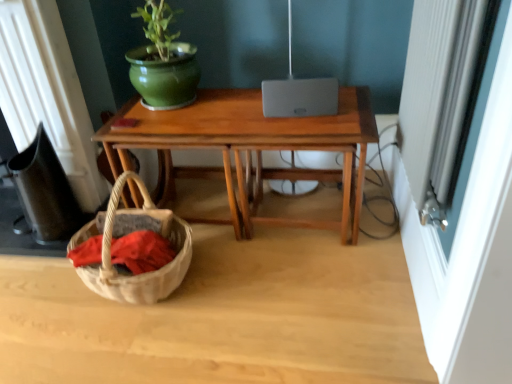
What is the approximate width of wooden desk at center?

It is 19.92 inches.

Identify the location of satin silver lamp at center. This screenshot has width=512, height=384. (298, 91).

At what (x,y) coordinates should I click in order to perform the action: click on white textured screen door at right. Please return your answer as a coordinate pair (x, y). This screenshot has height=384, width=512. Looking at the image, I should click on (460, 190).

The height and width of the screenshot is (384, 512). What do you see at coordinates (460, 190) in the screenshot? I see `white textured screen door at right` at bounding box center [460, 190].

The height and width of the screenshot is (384, 512). In order to click on wooden desk at center in this screenshot , I will do `click(249, 149)`.

Can you confirm if white textured screen door at right is thinner than wooden desk at center?

Indeed, white textured screen door at right has a lesser width compared to wooden desk at center.

Considering the sizes of objects white textured screen door at right and wooden desk at center in the image provided, who is taller, white textured screen door at right or wooden desk at center?

white textured screen door at right.

Is white textured screen door at right positioned in front of wooden desk at center?

Yes, the depth of white textured screen door at right is less than that of wooden desk at center.

Considering the positions of objects white textured screen door at right and wooden desk at center in the image provided, who is more to the right, white textured screen door at right or wooden desk at center?

From the viewer's perspective, white textured screen door at right appears more on the right side.

Is white textured screen door at right facing towards satin silver lamp at center?

No, white textured screen door at right is not facing towards satin silver lamp at center.

Choose the correct answer: Is white textured screen door at right inside satin silver lamp at center or outside it?

white textured screen door at right is spatially situated outside satin silver lamp at center.

Between point (428, 28) and point (293, 98), which one is positioned in front?

The point (428, 28) is more forward.

From the image's perspective, which one is positioned lower, satin silver lamp at center or white textured screen door at right?

white textured screen door at right appears lower in the image.

Is satin silver lamp at center next to white textured screen door at right and touching it?

No, satin silver lamp at center is not touching white textured screen door at right.

Between satin silver lamp at center and white textured screen door at right, which one appears on the left side from the viewer's perspective?

satin silver lamp at center is more to the left.

From the image's perspective, who appears lower, satin silver lamp at center or wooden desk at center?

wooden desk at center, from the image's perspective.

Where is `lamp that is above the wooden desk at center (from a real-world perspective)`? This screenshot has height=384, width=512. lamp that is above the wooden desk at center (from a real-world perspective) is located at coordinates (298, 91).

Does satin silver lamp at center have a larger size compared to wooden desk at center?

Incorrect, satin silver lamp at center is not larger than wooden desk at center.

Is satin silver lamp at center aimed at wooden desk at center?

Yes, satin silver lamp at center is aimed at wooden desk at center.

Is wooden desk at center wider than white textured screen door at right?

Yes, wooden desk at center is wider than white textured screen door at right.

Is the depth of wooden desk at center greater than that of white textured screen door at right?

Yes.

From a real-world perspective, which is physically above, wooden desk at center or white textured screen door at right?

white textured screen door at right, from a real-world perspective.

Can you confirm if wooden desk at center is bigger than white textured screen door at right?

Indeed, wooden desk at center has a larger size compared to white textured screen door at right.

Who is bigger, wooden desk at center or satin silver lamp at center?

With larger size is wooden desk at center.

Can you confirm if wooden desk at center is taller than satin silver lamp at center?

No.

The height and width of the screenshot is (384, 512). What are the coordinates of `desk that appears below the satin silver lamp at center (from the image's perspective)` in the screenshot? It's located at (249, 149).

From the picture: Is wooden desk at center oriented away from satin silver lamp at center?

Yes, wooden desk at center is facing away from satin silver lamp at center.

What are the coordinates of `desk lying below the white textured screen door at right (from the image's perspective)` in the screenshot? It's located at (249, 149).

The height and width of the screenshot is (384, 512). I want to click on lamp on the left side of white textured screen door at right, so (298, 91).

Estimate the real-world distances between objects in this image. Which object is further from satin silver lamp at center, white textured screen door at right or wooden desk at center?

white textured screen door at right is positioned further to the anchor satin silver lamp at center.

Looking at this image, considering their positions, is white textured screen door at right positioned further to wooden desk at center than satin silver lamp at center?

white textured screen door at right.

Estimate the real-world distances between objects in this image. Which object is closer to satin silver lamp at center, wooden desk at center or white textured screen door at right?

wooden desk at center.

Which object lies further to the anchor point white textured screen door at right, satin silver lamp at center or wooden desk at center?

Among the two, satin silver lamp at center is located further to white textured screen door at right.

Which object lies nearer to the anchor point white textured screen door at right, wooden desk at center or satin silver lamp at center?

Among the two, wooden desk at center is located nearer to white textured screen door at right.

Looking at the image, which one is located closer to wooden desk at center, satin silver lamp at center or white textured screen door at right?

Among the two, satin silver lamp at center is located nearer to wooden desk at center.

You are a GUI agent. You are given a task and a screenshot of the screen. Output one action in this format:
    pyautogui.click(x=<x>, y=<y>)
    Task: Click on the desk between white textured screen door at right and satin silver lamp at center from front to back
    This screenshot has height=384, width=512.
    Given the screenshot: What is the action you would take?
    pyautogui.click(x=249, y=149)